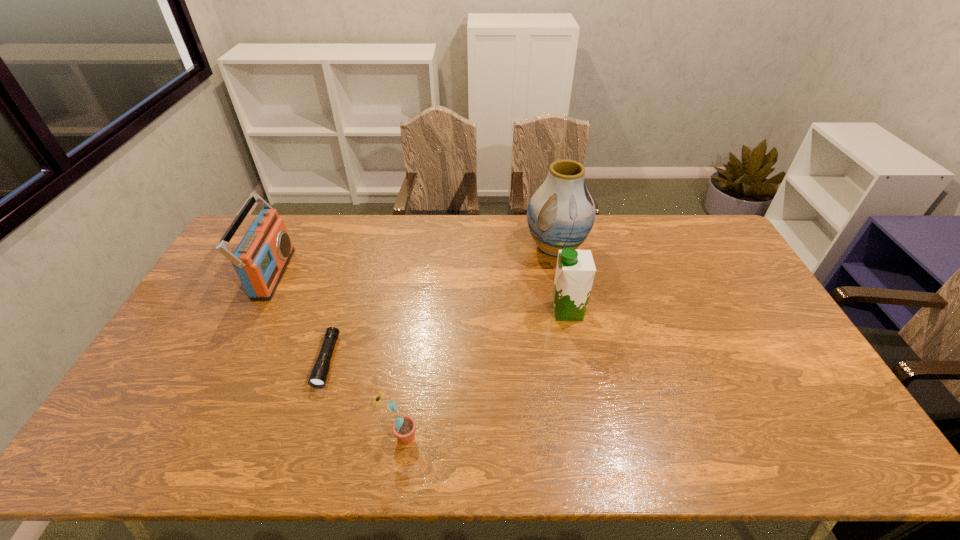
At what (x,y) coordinates should I click in order to perform the action: click on vase. Please return your answer as a coordinate pair (x, y). The image size is (960, 540). Looking at the image, I should click on (561, 213).

The image size is (960, 540). In order to click on soya milk in this screenshot , I will do `click(575, 271)`.

At what (x,y) coordinates should I click in order to perform the action: click on radio receiver. Please return your answer as a coordinate pair (x, y). This screenshot has width=960, height=540. Looking at the image, I should click on (262, 256).

Where is `the nearest object`? the nearest object is located at coordinates (404, 427).

At what (x,y) coordinates should I click in order to perform the action: click on sunflower. Please return your answer as a coordinate pair (x, y). This screenshot has width=960, height=540. Looking at the image, I should click on (404, 427).

Locate an element on the screen. The image size is (960, 540). the fourth object from right to left is located at coordinates (318, 377).

This screenshot has height=540, width=960. In order to click on the shortest object in this screenshot , I will do `click(318, 377)`.

At what (x,y) coordinates should I click in order to perform the action: click on free region located 0.230m on the right of the tallest object. Please return your answer as a coordinate pair (x, y). The image size is (960, 540). Looking at the image, I should click on [651, 247].

Locate an element on the screen. This screenshot has height=540, width=960. free point located 0.300m on the front-facing side of the soya milk is located at coordinates point(454,312).

You are a GUI agent. You are given a task and a screenshot of the screen. Output one action in this format:
    pyautogui.click(x=<x>, y=<y>)
    Task: Click on the vacant space located 0.340m on the front-facing side of the soya milk
    The width and height of the screenshot is (960, 540).
    Given the screenshot: What is the action you would take?
    pyautogui.click(x=441, y=312)